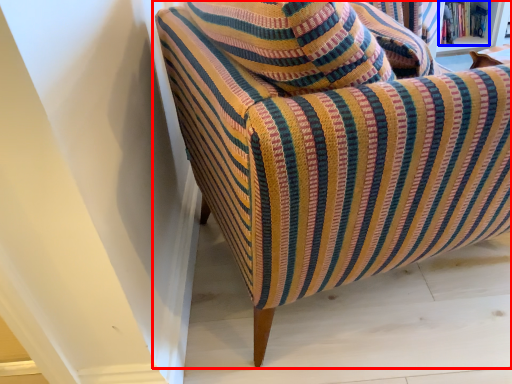
Question: Which of the following is the farthest to the observer, chair (highlighted by a red box) or book (highlighted by a blue box)?

Choices:
 (A) chair
 (B) book

Answer: (B)